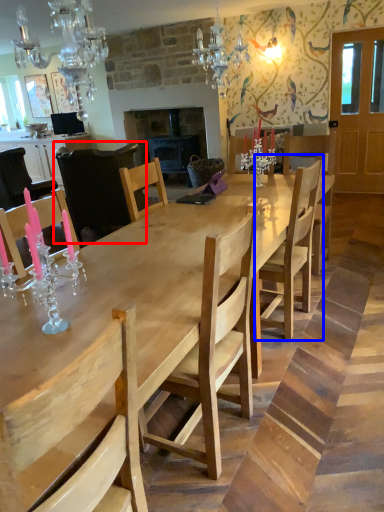
Question: Among these objects, which one is farthest to the camera, chair (highlighted by a red box) or chair (highlighted by a blue box)?

Choices:
 (A) chair
 (B) chair

Answer: (A)